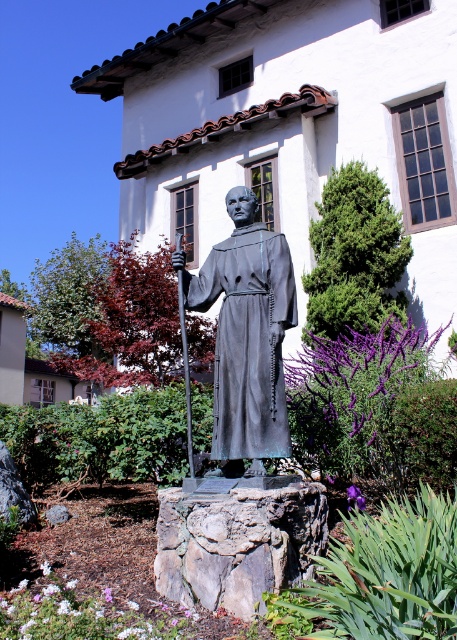
Does green mossy rock at center have a larger size compared to polished bronze robe at center?

Indeed, green mossy rock at center has a larger size compared to polished bronze robe at center.

Is green mossy rock at center smaller than polished bronze robe at center?

No, green mossy rock at center is not smaller than polished bronze robe at center.

Locate an element on the screen. The height and width of the screenshot is (640, 457). green mossy rock at center is located at coordinates (372, 413).

Consider the image. Is rough textured stone at center above polished bronze robe at center?

No, rough textured stone at center is not above polished bronze robe at center.

You are a GUI agent. You are given a task and a screenshot of the screen. Output one action in this format:
    pyautogui.click(x=<x>, y=<y>)
    Task: Click on the rough textured stone at center
    This screenshot has width=457, height=640.
    Given the screenshot: What is the action you would take?
    pyautogui.click(x=238, y=541)

Identify the location of rough textured stone at center. (238, 541).

Where is `rough textured stone at center`? rough textured stone at center is located at coordinates (238, 541).

Is green mossy rock at center smaller than rough textured stone at center?

Actually, green mossy rock at center might be larger than rough textured stone at center.

Who is taller, green mossy rock at center or rough textured stone at center?

With more height is green mossy rock at center.

Locate an element on the screen. green mossy rock at center is located at coordinates (372, 413).